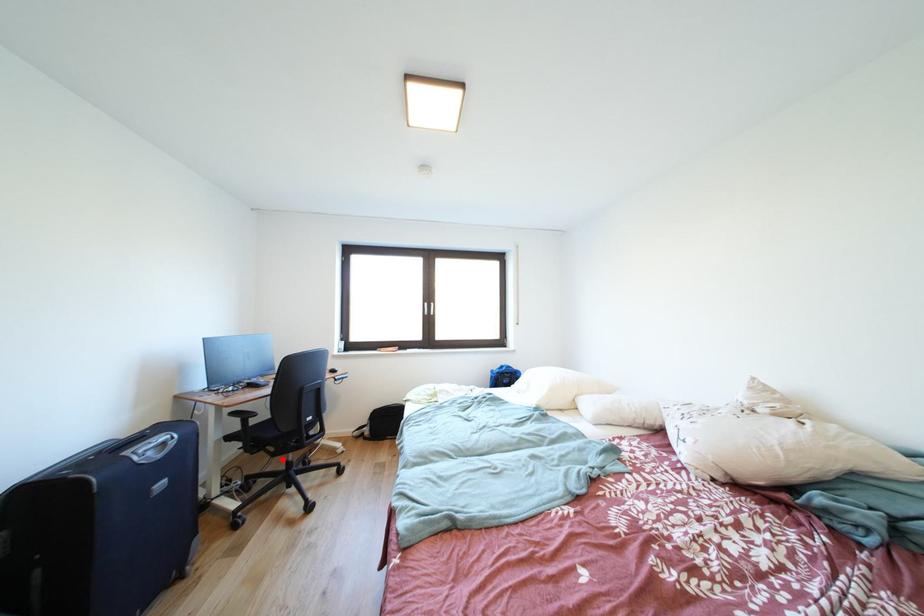
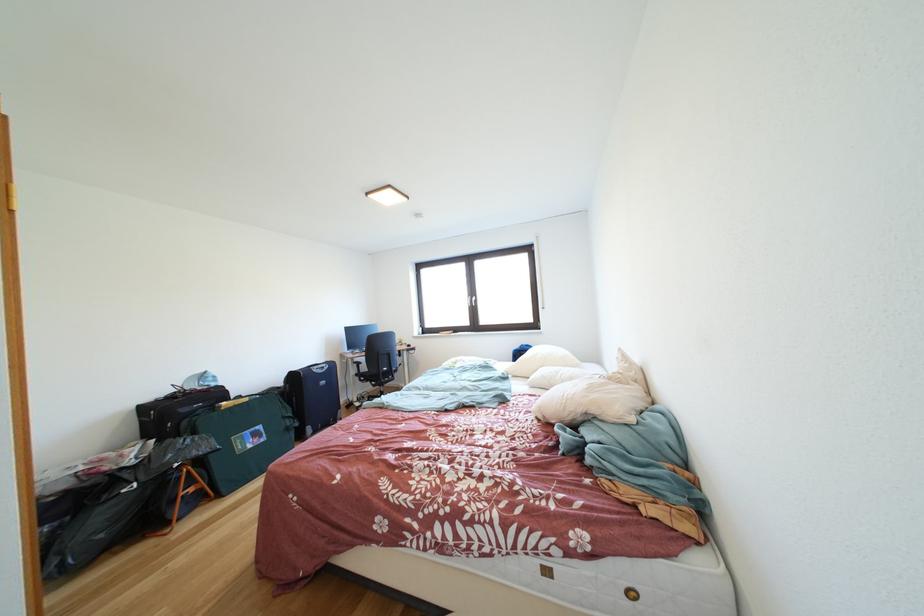
Question: I am providing you with two images of the same scene from different viewpoints. In image1, a red point is highlighted. Considering the same 3D point in image2, which of the following is correct?

Choices:
 (A) It is closer
 (B) It is farther

Answer: (B)